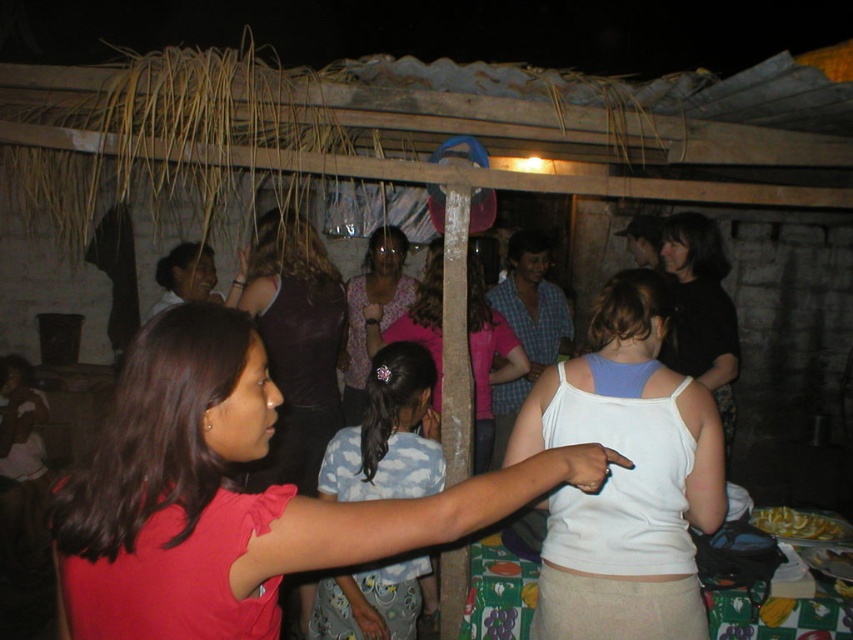
Is point (128, 499) closer to camera compared to point (281, 246)?

Yes.

Can you confirm if pink fabric shirt at center is bigger than matte purple tank top at center?

Actually, pink fabric shirt at center might be smaller than matte purple tank top at center.

Is point (80, 564) positioned behind point (283, 250)?

That is False.

This screenshot has height=640, width=853. Find the location of `pink fabric shirt at center`. pink fabric shirt at center is located at coordinates (233, 497).

Which is above, white fabric tank top at center or pink fabric at center?

pink fabric at center is above.

Which is below, white fabric tank top at center or pink fabric at center?

white fabric tank top at center is lower down.

Between point (579, 440) and point (436, 300), which one is positioned behind?

The point (436, 300) is behind.

I want to click on white fabric tank top at center, so click(x=625, y=477).

Can you confirm if white fabric tank top at center is shorter than floral fabric blouse at center?

Indeed, white fabric tank top at center has a lesser height compared to floral fabric blouse at center.

The width and height of the screenshot is (853, 640). What are the coordinates of `white fabric tank top at center` in the screenshot? It's located at (625, 477).

Is point (601, 381) closer to viewer compared to point (364, 298)?

Yes, it is.

Find the location of a particular element. The image size is (853, 640). white fabric tank top at center is located at coordinates (625, 477).